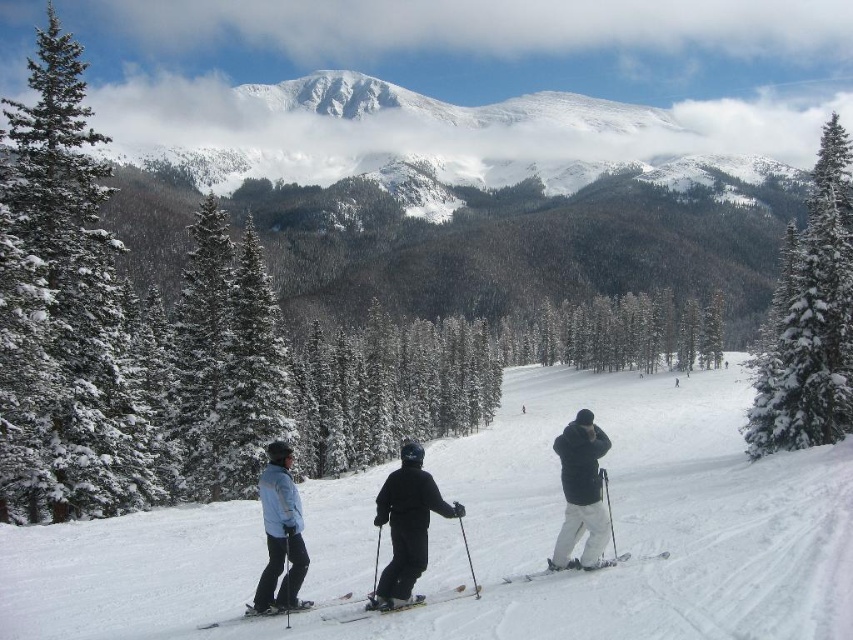
Question: Is black matte ski at lower center in front of white matte ski at center?

Choices:
 (A) yes
 (B) no

Answer: (A)

Question: Is the position of snow-covered evergreen at center-right less distant than that of black matte ski at center?

Choices:
 (A) no
 (B) yes

Answer: (A)

Question: Considering the real-world distances, which object is farthest from the green textured pine tree at left?

Choices:
 (A) light blue jacket at center
 (B) white matte ski at center

Answer: (B)

Question: Which point is farther to the camera?

Choices:
 (A) (364, 604)
 (B) (247, 609)

Answer: (A)

Question: Is white snow ski slope at center further to camera compared to snow-covered evergreen at center-right?

Choices:
 (A) no
 (B) yes

Answer: (A)

Question: Which of the following is the closest to the observer?

Choices:
 (A) (430, 486)
 (B) (576, 468)
 (C) (619, 563)

Answer: (A)